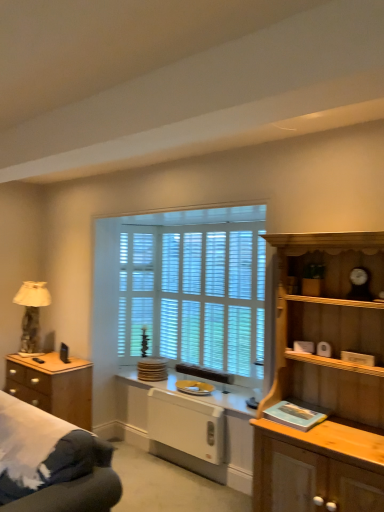
Measure the distance between point [163,420] and camera.

The distance of point [163,420] from camera is 3.60 meters.

What do you see at coordinates (181, 289) in the screenshot?
I see `white wooden blinds at center` at bounding box center [181, 289].

This screenshot has width=384, height=512. Describe the element at coordinates (53, 386) in the screenshot. I see `brown wooden chest of drawers at left` at that location.

This screenshot has height=512, width=384. In order to click on brown wooden chest of drawers at left in this screenshot , I will do click(53, 386).

Where is `light wood cabinet at right`? light wood cabinet at right is located at coordinates (325, 382).

At what (x,y) coordinates should I click in order to perform the action: click on beige fabric lampshade at left. Please return your answer as a coordinate pair (x, y). Image resolution: width=384 pixels, height=512 pixels. Looking at the image, I should click on (31, 314).

Describe the element at coordinates (195, 396) in the screenshot. I see `white glossy countertop at center` at that location.

I want to click on white glossy radiator at lower center, which is the 2th appliance from top to bottom, so click(x=186, y=425).

From the image's perspective, which one is positioned lower, beige fabric lampshade at left or white glossy radiator at lower center, arranged as the first appliance when ordered from the bottom?

white glossy radiator at lower center, arranged as the first appliance when ordered from the bottom.

Where is `the 2nd appliance positioned below the beige fabric lampshade at left (from a real-world perspective)`? The image size is (384, 512). the 2nd appliance positioned below the beige fabric lampshade at left (from a real-world perspective) is located at coordinates (186, 425).

Is beige fabric lampshade at left bigger than white glossy radiator at lower center, arranged as the first appliance when ordered from the bottom?

Yes, beige fabric lampshade at left is bigger than white glossy radiator at lower center, arranged as the first appliance when ordered from the bottom.

Which point is more distant from viewer, (233, 336) or (21, 286)?

Point (21, 286)

Would you say white wood blinds at center is outside beige fabric lampshade at left?

Indeed, white wood blinds at center is completely outside beige fabric lampshade at left.

This screenshot has width=384, height=512. What are the coordinates of `table lamp to the left of white wood blinds at center` in the screenshot? It's located at (31, 314).

Looking at this image, does white wood blinds at center have a smaller size compared to white wooden blinds at center?

Indeed, white wood blinds at center has a smaller size compared to white wooden blinds at center.

Is white wood blinds at center wider than white wooden blinds at center?

No, white wood blinds at center is not wider than white wooden blinds at center.

From a real-world perspective, is white wood blinds at center physically located above or below white wooden blinds at center?

From a real-world perspective, white wood blinds at center is physically above white wooden blinds at center.

Considering the relative sizes of white wood blinds at center and white wooden blinds at center in the image provided, is white wood blinds at center taller than white wooden blinds at center?

Incorrect, the height of white wood blinds at center is not larger of that of white wooden blinds at center.

Consider the image. From a real-world perspective, which object stands above the other?

In real-world perspective, white wood blinds at center is above.

Where is `glass door that is behind the white glossy radiator at lower center, which is the 2th appliance from top to bottom`? The height and width of the screenshot is (512, 384). glass door that is behind the white glossy radiator at lower center, which is the 2th appliance from top to bottom is located at coordinates (213, 296).

Which is behind, point (158, 430) or point (214, 274)?

Point (214, 274)

Based on the photo, which point is more distant from viewer, (83, 426) or (241, 318)?

The point (83, 426) is more distant.

Is there a large distance between brown wooden chest of drawers at left and white wooden blinds at center?

Yes, brown wooden chest of drawers at left is far from white wooden blinds at center.

From a real-world perspective, between white glossy plate at center, which is counted as the 2th appliance, starting from the bottom, and beige fabric lampshade at left, who is vertically lower?

white glossy plate at center, which is counted as the 2th appliance, starting from the bottom, is physically lower.

Does white glossy plate at center, which is counted as the 2th appliance, starting from the bottom, have a lesser width compared to beige fabric lampshade at left?

Yes, white glossy plate at center, which is counted as the 2th appliance, starting from the bottom, is thinner than beige fabric lampshade at left.

In terms of height, does white glossy plate at center, the 1th appliance when ordered from top to bottom, look taller or shorter compared to beige fabric lampshade at left?

Considering their sizes, white glossy plate at center, the 1th appliance when ordered from top to bottom, has less height than beige fabric lampshade at left.

Which is correct: white glossy plate at center, which is counted as the 2th appliance, starting from the bottom, is inside beige fabric lampshade at left, or outside of it?

white glossy plate at center, which is counted as the 2th appliance, starting from the bottom, cannot be found inside beige fabric lampshade at left.

Is white glossy plate at center, which is counted as the 2th appliance, starting from the bottom, smaller than white wooden blinds at center?

Indeed, white glossy plate at center, which is counted as the 2th appliance, starting from the bottom, has a smaller size compared to white wooden blinds at center.

Is white glossy plate at center, the 1th appliance when ordered from top to bottom, positioned far away from white wooden blinds at center?

No.

Considering the relative positions of white glossy plate at center, which is counted as the 2th appliance, starting from the bottom, and white wooden blinds at center in the image provided, is white glossy plate at center, which is counted as the 2th appliance, starting from the bottom, behind white wooden blinds at center?

Yes, it is behind white wooden blinds at center.

Between point (206, 386) and point (147, 247), which one is positioned in front?

The point (206, 386) is closer.

Locate an element on the screen. This screenshot has height=512, width=384. table lamp on the left of the white glossy radiator at lower center, which is the 2th appliance from top to bottom is located at coordinates (31, 314).

At what (x,y) coordinates should I click in order to perform the action: click on table lamp below the white wood blinds at center (from the image's perspective). Please return your answer as a coordinate pair (x, y). Looking at the image, I should click on (31, 314).

Considering their positions, is white plastic radiator at lower center positioned closer to beige fabric lampshade at left than white glossy radiator at lower center, arranged as the first appliance when ordered from the bottom?

Based on the image, white plastic radiator at lower center appears to be nearer to beige fabric lampshade at left.

In the scene shown: Estimate the real-world distances between objects in this image. Which object is closer to light wood cabinet at right, beige fabric lampshade at left or white plastic radiator at lower center?

The object closer to light wood cabinet at right is white plastic radiator at lower center.

Looking at this image, from the image, which object appears to be farther from brown wooden chest of drawers at left, white wood blinds at center or light wood cabinet at right?

The object further to brown wooden chest of drawers at left is light wood cabinet at right.

Estimate the real-world distances between objects in this image. Which object is further from brown wooden chest of drawers at left, white glossy countertop at center or white wooden blinds at center?

white wooden blinds at center is positioned further to the anchor brown wooden chest of drawers at left.

Considering their positions, is brown wooden chest of drawers at left positioned closer to white glossy radiator at lower center, which is the 2th appliance from top to bottom, than beige fabric lampshade at left?

Based on the image, brown wooden chest of drawers at left appears to be nearer to white glossy radiator at lower center, which is the 2th appliance from top to bottom.

Which object lies nearer to the anchor point white glossy countertop at center, brown wooden chest of drawers at left or white glossy plate at center, which is counted as the 2th appliance, starting from the bottom?

Among the two, white glossy plate at center, which is counted as the 2th appliance, starting from the bottom, is located nearer to white glossy countertop at center.

When comparing their distances from beige fabric lampshade at left, does white wooden blinds at center or white glossy radiator at lower center, arranged as the first appliance when ordered from the bottom, seem closer?

Among the two, white wooden blinds at center is located nearer to beige fabric lampshade at left.

Estimate the real-world distances between objects in this image. Which object is closer to light wood cabinet at right, brown wooden chest of drawers at left or white glossy radiator at lower center, which is the 2th appliance from top to bottom?

The object closer to light wood cabinet at right is white glossy radiator at lower center, which is the 2th appliance from top to bottom.

Locate an element on the screen. chest of drawers between beige fabric lampshade at left and white wooden blinds at center from left to right is located at coordinates (53, 386).

You are a GUI agent. You are given a task and a screenshot of the screen. Output one action in this format:
    pyautogui.click(x=<x>, y=<y>)
    Task: Click on the chest of drawers between beige fabric lampshade at left and white glossy radiator at lower center, arranged as the first appliance when ordered from the bottom
    The width and height of the screenshot is (384, 512).
    Given the screenshot: What is the action you would take?
    pos(53,386)

The width and height of the screenshot is (384, 512). I want to click on computer desk between beige fabric lampshade at left and white glossy countertop at center from left to right, so (x=183, y=446).

I want to click on computer desk between brown wooden chest of drawers at left and white glossy plate at center, the 1th appliance when ordered from top to bottom, from left to right, so click(x=183, y=446).